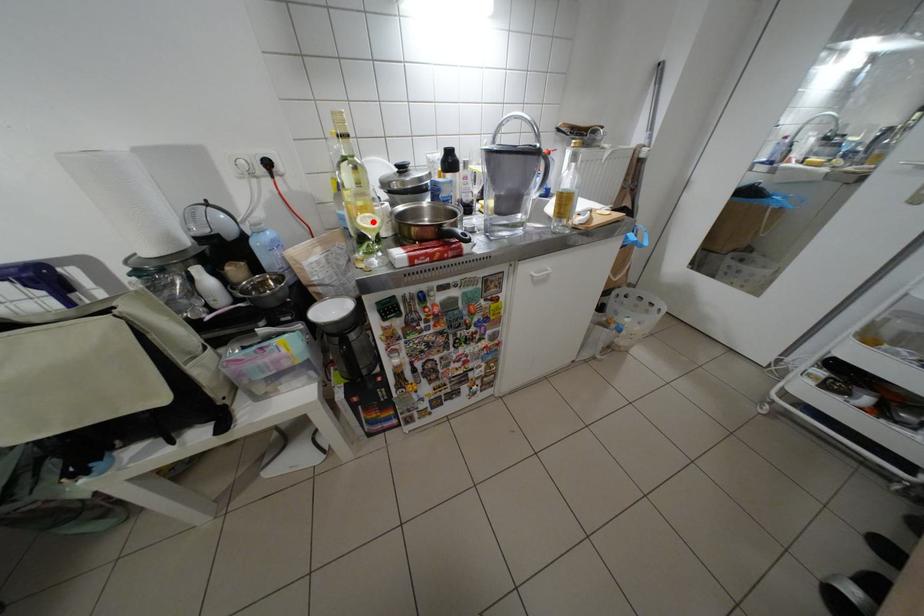
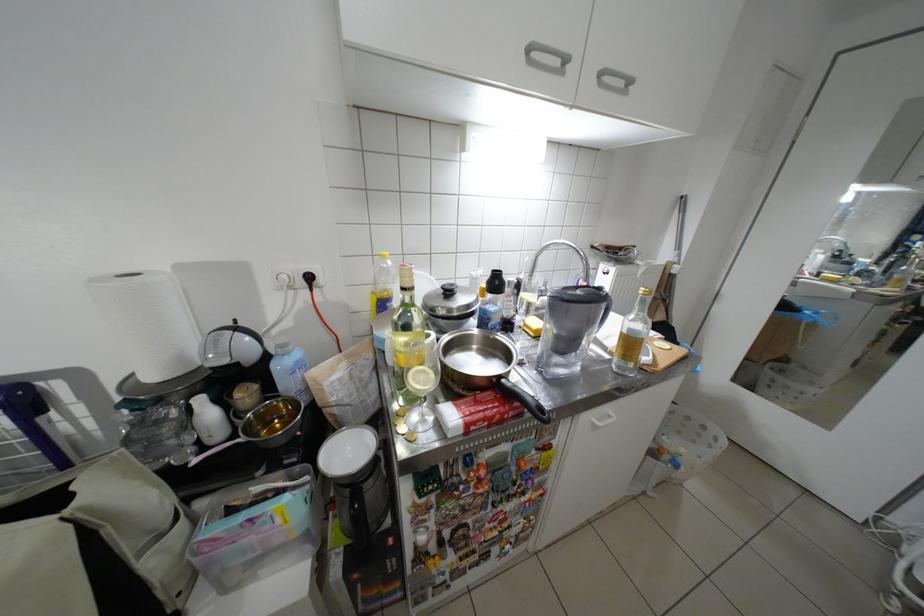
Question: I am providing you with two images of the same scene from different viewpoints. A red point is marked on the first image. Is the red point's position out of view in image 2?

Choices:
 (A) Yes
 (B) No

Answer: (B)